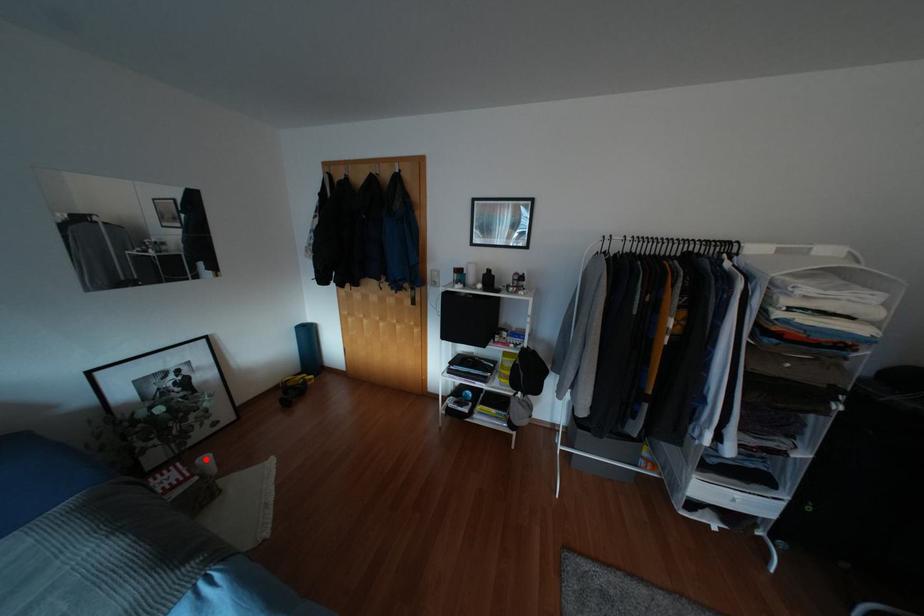
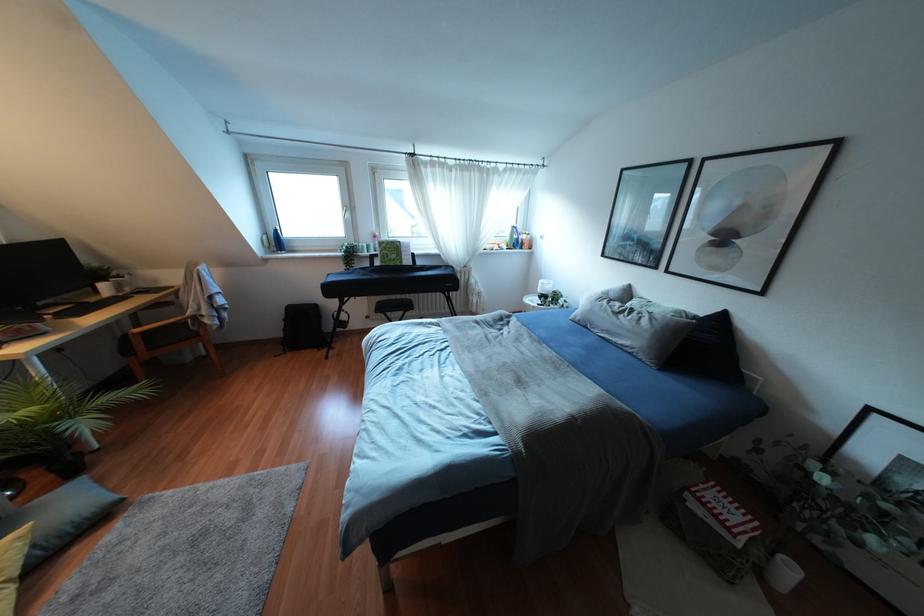
Question: I am providing you with two images of the same scene from different viewpoints. Given a red point in image1, look at the same physical point in image2. Is it:

Choices:
 (A) Closer to the viewpoint
 (B) Farther from the viewpoint

Answer: (A)